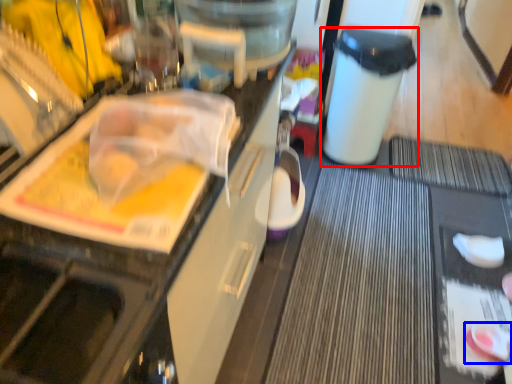
Question: Which of the following is the farthest to the observer, trash bin/can (highlighted by a red box) or food (highlighted by a blue box)?

Choices:
 (A) trash bin/can
 (B) food

Answer: (A)